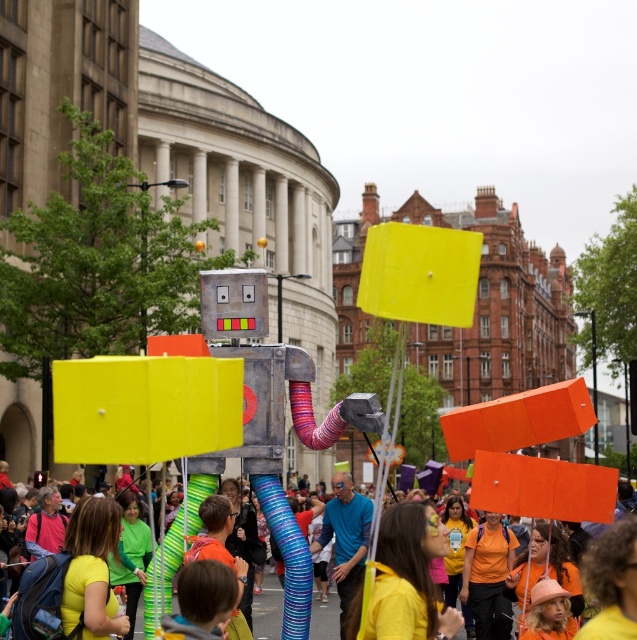
Is yellow fabric headband at center behind blue fabric at center?

No, yellow fabric headband at center is closer to the viewer.

Does yellow fabric headband at center have a larger size compared to blue fabric at center?

Actually, yellow fabric headband at center might be smaller than blue fabric at center.

Is point (413, 518) farther from camera compared to point (352, 509)?

No, (413, 518) is in front of (352, 509).

Locate an element on the screen. The height and width of the screenshot is (640, 637). yellow fabric headband at center is located at coordinates (408, 577).

Does yellow fabric headband at center appear under orange cardboard sign at center?

No, yellow fabric headband at center is not below orange cardboard sign at center.

Identify the location of yellow fabric headband at center. The image size is (637, 640). (408, 577).

Does blue fabric at center have a smaller size compared to orange cardboard sign at center?

Correct, blue fabric at center occupies less space than orange cardboard sign at center.

Is blue fabric at center shorter than orange cardboard sign at center?

Correct, blue fabric at center is not as tall as orange cardboard sign at center.

Between point (340, 612) and point (315, 634), which one is positioned in front?

Positioned in front is point (340, 612).

Find the location of a particular element. The width and height of the screenshot is (637, 640). blue fabric at center is located at coordinates (345, 538).